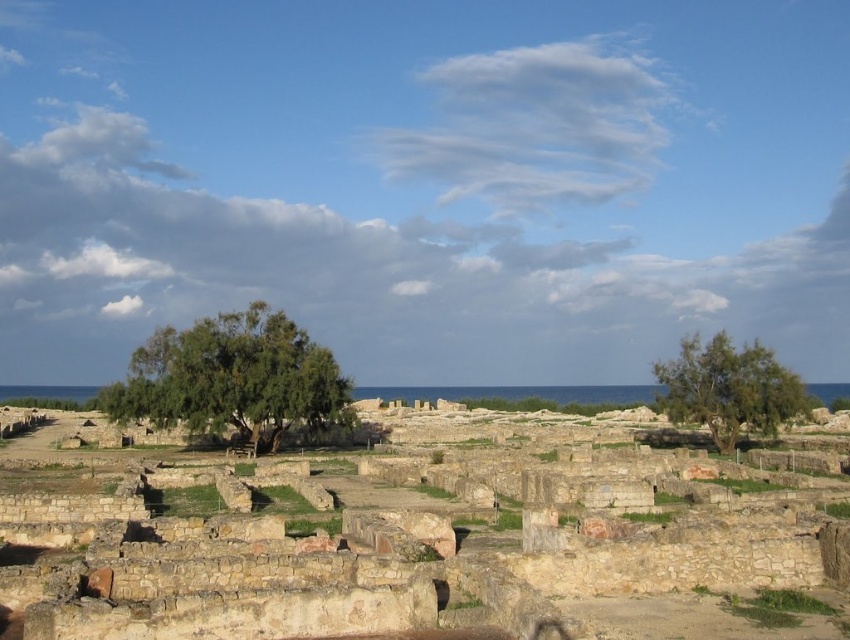
You are standing at the origin point of the coordinate system in the archaeological site. The brown stone amphitheater at center is located at coordinates approximately 0.873 on the x axis and 0.456 on the y axis. If you want to reach the amphitheater from your current position, in which general direction should you move? Please choose from the following options and explain your reasoning based on the coordinates provided. The options are north, south, east, west, northeast, northwest, southeast, southwest,

The brown stone amphitheater at center is located at coordinates approximately 0.873 on the x axis and 0.456 on the y axis. Since the x coordinate is higher than 0.5 and the y coordinate is also higher than 0.5, this means the amphitheater is to the northeast direction from the origin. Therefore, you should move northeast to reach it.

You are an archaeologist examining the site. You need to determine which object occupies more space in the scene between the brown stone amphitheater at center and the green leafy tree at right. Which one is larger?

The brown stone amphitheater at center has a larger size compared to the green leafy tree at right, so the brown stone amphitheater at center occupies more space in the scene.